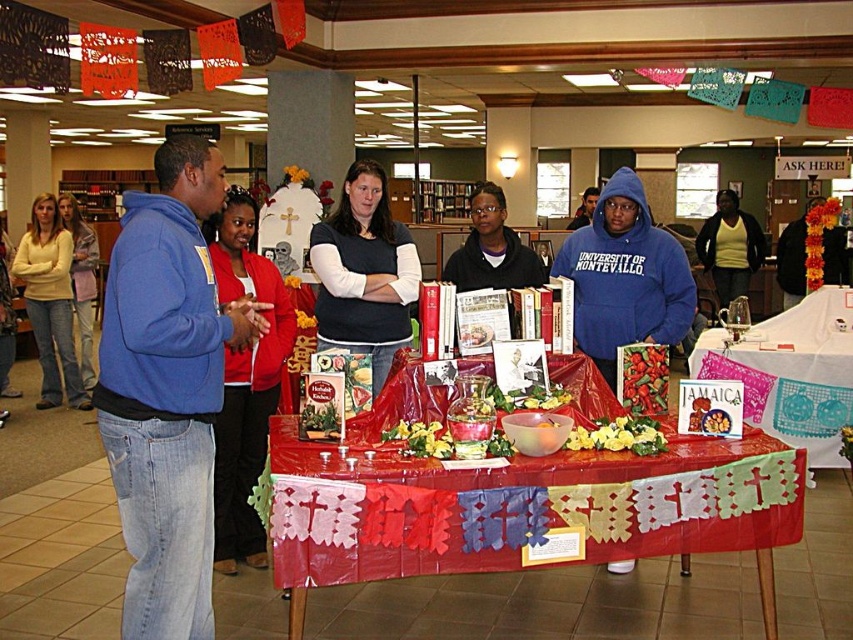
Is red paper tablecloth at center to the left of matte yellow sweater at left from the viewer's perspective?

In fact, red paper tablecloth at center is to the right of matte yellow sweater at left.

Is point (833, 458) less distant than point (73, 365)?

Yes, point (833, 458) is in front of point (73, 365).

The image size is (853, 640). Find the location of `red paper tablecloth at center`. red paper tablecloth at center is located at coordinates (791, 372).

Image resolution: width=853 pixels, height=640 pixels. In order to click on red paper tablecloth at center in this screenshot , I will do `click(791, 372)`.

Does matte yellow sweater at left appear on the right side of light yellow sweater at center?

No, matte yellow sweater at left is not to the right of light yellow sweater at center.

Is point (61, 253) less distant than point (86, 244)?

Yes, point (61, 253) is closer to viewer.

Which is behind, point (61, 300) or point (76, 296)?

Positioned behind is point (76, 296).

Locate an element on the screen. matte yellow sweater at left is located at coordinates (50, 301).

Who is lower down, red paper tablecloth at center or matte black sweater at center?

Positioned lower is red paper tablecloth at center.

Does point (766, 349) come behind point (397, 225)?

Yes, it is behind point (397, 225).

Is point (738, 368) closer to viewer compared to point (352, 308)?

No.

Find the location of a particular element. red paper tablecloth at center is located at coordinates (791, 372).